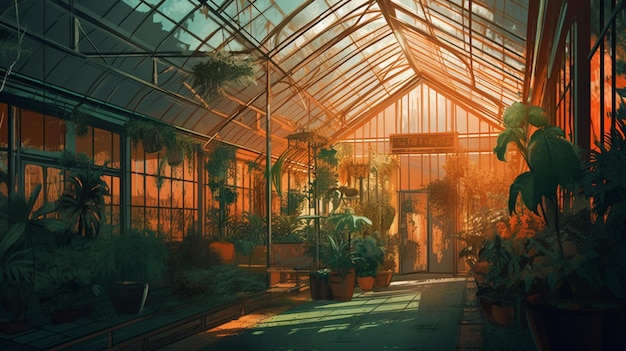
This screenshot has height=351, width=626. I want to click on plant, so click(327, 184), click(565, 158), click(78, 198), click(228, 80), click(166, 144), click(103, 274).